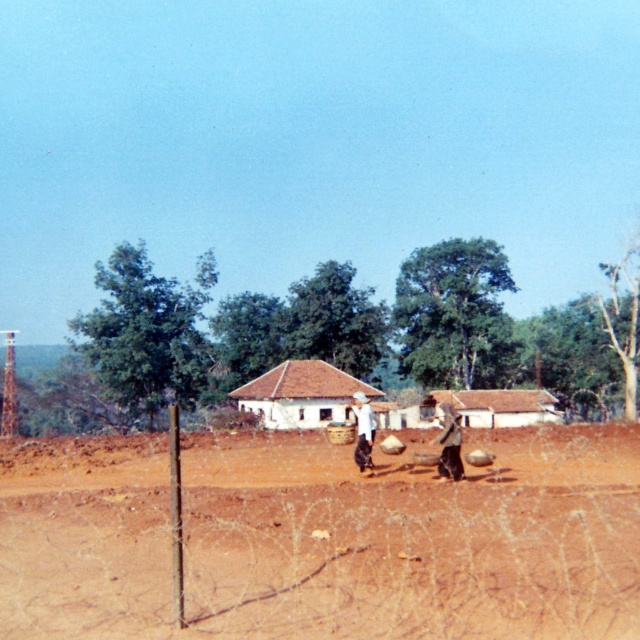
Looking at this image, does brown dirt field at center appear on the left side of brown clay hut at center?

Incorrect, brown dirt field at center is not on the left side of brown clay hut at center.

Measure the distance between brown dirt field at center and camera.

The distance of brown dirt field at center from camera is 7.32 meters.

Is point (321, 480) behind point (262, 420)?

That is False.

Where is `brown dirt field at center`? The width and height of the screenshot is (640, 640). brown dirt field at center is located at coordinates (337, 545).

Can you confirm if white clay house at center is bigger than brown fabric bag at center?

Yes, white clay house at center is bigger than brown fabric bag at center.

Between white clay house at center and brown fabric bag at center, which one is positioned higher?

brown fabric bag at center is higher up.

This screenshot has width=640, height=640. In order to click on white clay house at center in this screenshot , I will do `click(380, 401)`.

Locate an element on the screen. brown corrugated metal hut at center is located at coordinates (497, 406).

Is brown corrugated metal hut at center behind brown fabric bag at center?

Yes, brown corrugated metal hut at center is behind brown fabric bag at center.

Which is in front, point (493, 408) or point (452, 438)?

Positioned in front is point (452, 438).

This screenshot has width=640, height=640. Identify the location of brown corrugated metal hut at center. (497, 406).